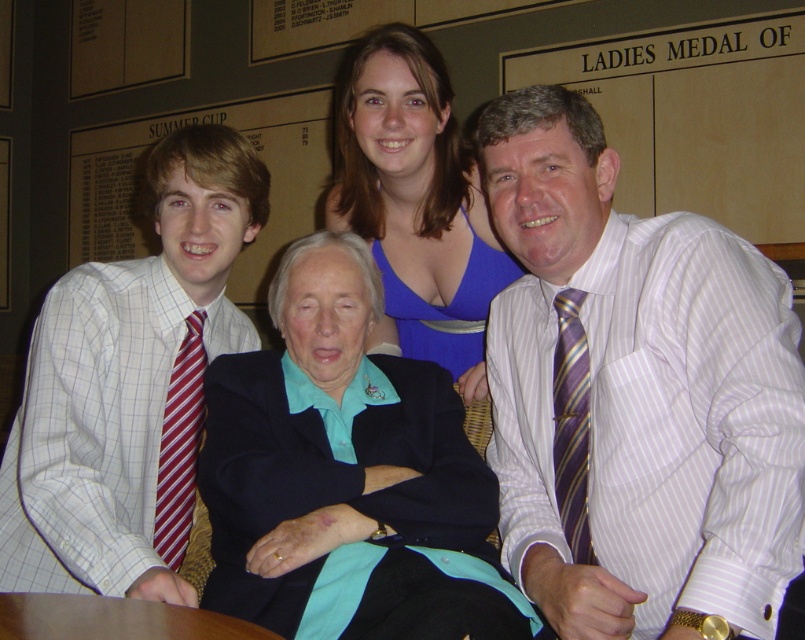
Based on the photo, you are an event photographer who needs to ensure all attire details are captured clearly. The white checkered shirt at left and the red striped tie at left are part of the same outfit. Which one is visible on top of the other?

The white checkered shirt at left is positioned over the red striped tie at left, so the shirt is visible on top of the tie.

Based on the photo, you are organizing a photo shoot and need to ensure that all attire items fit into a rectangular display case. The case has a maximum width capacity of 30 cm. Given that the blue fabric dress at upper center is wider than the striped silk tie at right, can both items fit side by side in the case without overlapping?

The blue fabric dress at upper center has a larger width than the striped silk tie at right. Since the case can hold up to 30 cm, we need to know their exact widths. However, the description only states the dress is wider, not the exact measurements. Without specific widths, we can only assume that if the combined width of both items is under 30 cm, they could fit. But since the dress is wider, it might exceed the case capacity alone. More information is needed.